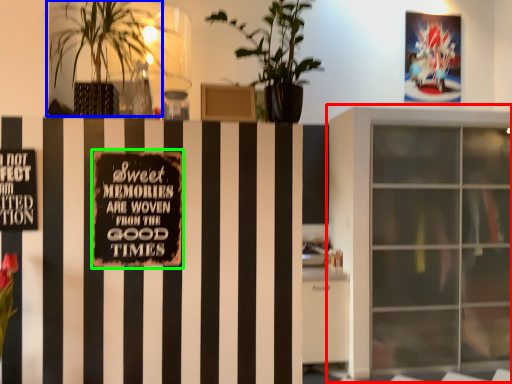
Question: Which object is positioned closest to window (highlighted by a red box)? Select from houseplant (highlighted by a blue box) and bulletin board (highlighted by a green box).

Choices:
 (A) houseplant
 (B) bulletin board

Answer: (A)